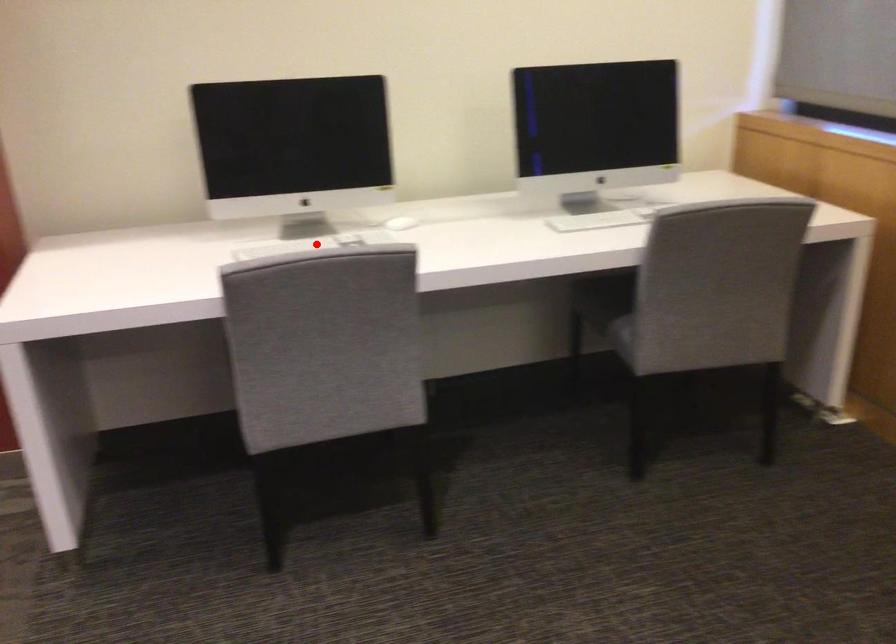
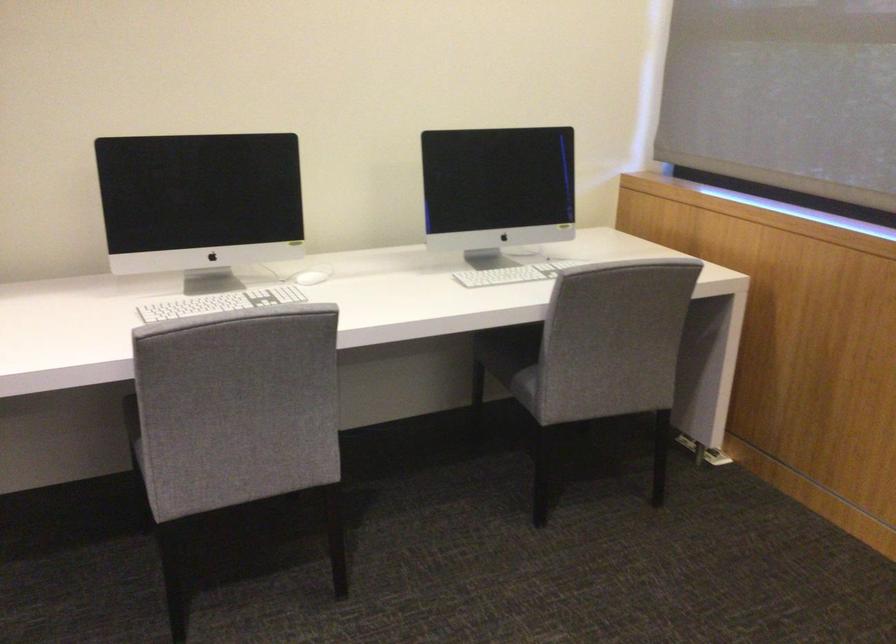
In the second image, find the point that corresponds to the highlighted location in the first image.

(220, 303)